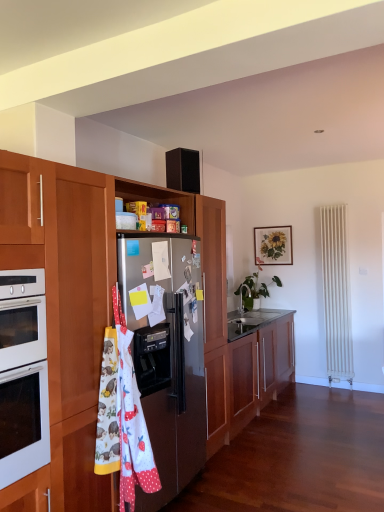
Image resolution: width=384 pixels, height=512 pixels. What are the coordinates of `wooden cabinet at center, the 2th cabinetry viewed from the top` in the screenshot? It's located at (258, 361).

Describe the element at coordinates (128, 327) in the screenshot. I see `wooden cabinet at center, marked as the 2th cabinetry in a bottom-to-top arrangement` at that location.

What do you see at coordinates (168, 359) in the screenshot? The height and width of the screenshot is (512, 384). I see `satin metallic refrigerator at center-left` at bounding box center [168, 359].

Identify the location of wooden cabinet at center, which is the first cabinetry from bottom to top. The height and width of the screenshot is (512, 384). (258, 361).

Would you consider wooden picture frame at upper center to be distant from white fabric apron at center-left?

wooden picture frame at upper center is positioned a significant distance from white fabric apron at center-left.

Does wooden picture frame at upper center contain white fabric apron at center-left?

A: No, white fabric apron at center-left is not surrounded by wooden picture frame at upper center.

Where is `material that is on the left side of wooden picture frame at upper center`? material that is on the left side of wooden picture frame at upper center is located at coordinates (131, 421).

What's the angular difference between wooden picture frame at upper center and white fabric apron at center-left's facing directions?

The angle between the facing direction of wooden picture frame at upper center and the facing direction of white fabric apron at center-left is 88.4 degrees.

From the picture: Which of these two, satin metallic refrigerator at center-left or green glossy plant at center, stands taller?

With more height is satin metallic refrigerator at center-left.

Which object is positioned more to the right, satin metallic refrigerator at center-left or green glossy plant at center?

From the viewer's perspective, green glossy plant at center appears more on the right side.

From the image's perspective, is satin metallic refrigerator at center-left positioned above or below green glossy plant at center?

satin metallic refrigerator at center-left is situated lower than green glossy plant at center in the image.

Considering the sizes of satin metallic refrigerator at center-left and wooden picture frame at upper center in the image, is satin metallic refrigerator at center-left taller or shorter than wooden picture frame at upper center?

In the image, satin metallic refrigerator at center-left appears to be taller than wooden picture frame at upper center.

Could you tell me if satin metallic refrigerator at center-left is turned towards wooden picture frame at upper center?

No.

From the image's perspective, which one is positioned lower, satin metallic refrigerator at center-left or wooden picture frame at upper center?

satin metallic refrigerator at center-left.

Locate an element on the screen. This screenshot has height=512, width=384. picture frame that appears above the satin metallic refrigerator at center-left (from a real-world perspective) is located at coordinates (273, 245).

Looking at their sizes, would you say wooden cabinet at center, marked as the 2th cabinetry in a bottom-to-top arrangement, is wider or thinner than wooden picture frame at upper center?

wooden cabinet at center, marked as the 2th cabinetry in a bottom-to-top arrangement, is wider than wooden picture frame at upper center.

Between wooden cabinet at center, the first cabinetry viewed from the top, and wooden picture frame at upper center, which one appears on the left side from the viewer's perspective?

From the viewer's perspective, wooden cabinet at center, the first cabinetry viewed from the top, appears more on the left side.

Is wooden cabinet at center, the first cabinetry viewed from the top, next to wooden picture frame at upper center?

No.

How distant is wooden cabinet at center, marked as the 2th cabinetry in a bottom-to-top arrangement, from wooden picture frame at upper center?

wooden cabinet at center, marked as the 2th cabinetry in a bottom-to-top arrangement, and wooden picture frame at upper center are 8.90 feet apart.

Which of these two, white fabric apron at center-left or wooden cabinet at center, the first cabinetry viewed from the top, stands taller?

wooden cabinet at center, the first cabinetry viewed from the top, is taller.

From a real-world perspective, is white fabric apron at center-left on wooden cabinet at center, the first cabinetry viewed from the top?

No, from a real-world perspective, white fabric apron at center-left is not above wooden cabinet at center, the first cabinetry viewed from the top.

Looking at their sizes, would you say white fabric apron at center-left is wider or thinner than wooden cabinet at center, marked as the 2th cabinetry in a bottom-to-top arrangement?

In the image, white fabric apron at center-left appears to be more narrow than wooden cabinet at center, marked as the 2th cabinetry in a bottom-to-top arrangement.

Looking at this image, considering the relative positions of white fabric apron at center-left and wooden cabinet at center, marked as the 2th cabinetry in a bottom-to-top arrangement, in the image provided, is white fabric apron at center-left to the right of wooden cabinet at center, marked as the 2th cabinetry in a bottom-to-top arrangement, from the viewer's perspective?

No, white fabric apron at center-left is not to the right of wooden cabinet at center, marked as the 2th cabinetry in a bottom-to-top arrangement.

From a real-world perspective, is wooden picture frame at upper center physically located above or below wooden cabinet at center, the first cabinetry viewed from the top?

wooden picture frame at upper center is above wooden cabinet at center, the first cabinetry viewed from the top.

Is wooden picture frame at upper center oriented away from wooden cabinet at center, the first cabinetry viewed from the top?

No, wooden picture frame at upper center is not facing the opposite direction of wooden cabinet at center, the first cabinetry viewed from the top.

Considering the relative positions of wooden picture frame at upper center and wooden cabinet at center, the first cabinetry viewed from the top, in the image provided, is wooden picture frame at upper center to the left of wooden cabinet at center, the first cabinetry viewed from the top, from the viewer's perspective?

Incorrect, wooden picture frame at upper center is not on the left side of wooden cabinet at center, the first cabinetry viewed from the top.

Would you consider wooden picture frame at upper center to be distant from wooden cabinet at center, the first cabinetry viewed from the top?

Yes, wooden picture frame at upper center and wooden cabinet at center, the first cabinetry viewed from the top, are located far from each other.

Can satin metallic refrigerator at center-left be found inside white fabric apron at center-left?

No, white fabric apron at center-left does not contain satin metallic refrigerator at center-left.

From the image's perspective, between white fabric apron at center-left and satin metallic refrigerator at center-left, who is located below?

white fabric apron at center-left is shown below in the image.

Is white fabric apron at center-left bigger than satin metallic refrigerator at center-left?

No.

Identify the location of picture frame located above the white fabric apron at center-left (from a real-world perspective). (273, 245).

Identify the location of refrigerator on the left of green glossy plant at center. This screenshot has height=512, width=384. (168, 359).

Looking at the image, which one is located further to satin metallic refrigerator at center-left, wooden picture frame at upper center or green glossy plant at center?

The object further to satin metallic refrigerator at center-left is wooden picture frame at upper center.

Which object lies further to the anchor point wooden cabinet at center, which is the first cabinetry from bottom to top, wooden picture frame at upper center or green glossy plant at center?

Based on the image, wooden picture frame at upper center appears to be further to wooden cabinet at center, which is the first cabinetry from bottom to top.

From the image, which object appears to be nearer to wooden cabinet at center, marked as the 2th cabinetry in a bottom-to-top arrangement, green glossy plant at center or wooden cabinet at center, which is the first cabinetry from bottom to top?

wooden cabinet at center, which is the first cabinetry from bottom to top.

From the image, which object appears to be nearer to wooden picture frame at upper center, green glossy plant at center or wooden cabinet at center, the first cabinetry viewed from the top?

Among the two, green glossy plant at center is located nearer to wooden picture frame at upper center.

Consider the image. From the image, which object appears to be farther from green glossy plant at center, white fabric apron at center-left or wooden cabinet at center, the 2th cabinetry viewed from the top?

A: white fabric apron at center-left is positioned further to the anchor green glossy plant at center.

When comparing their distances from wooden cabinet at center, the 2th cabinetry viewed from the top, does satin metallic refrigerator at center-left or green glossy plant at center seem further?

Among the two, satin metallic refrigerator at center-left is located further to wooden cabinet at center, the 2th cabinetry viewed from the top.

Which object lies nearer to the anchor point wooden picture frame at upper center, satin metallic refrigerator at center-left or green glossy plant at center?

green glossy plant at center lies closer to wooden picture frame at upper center than the other object.

When comparing their distances from green glossy plant at center, does wooden cabinet at center, which is the first cabinetry from bottom to top, or wooden picture frame at upper center seem further?

wooden picture frame at upper center.

This screenshot has height=512, width=384. Identify the location of houseplant between satin metallic refrigerator at center-left and wooden picture frame at upper center from front to back. (252, 290).

Where is `material between wooden cabinet at center, marked as the 2th cabinetry in a bottom-to-top arrangement, and satin metallic refrigerator at center-left from front to back`? material between wooden cabinet at center, marked as the 2th cabinetry in a bottom-to-top arrangement, and satin metallic refrigerator at center-left from front to back is located at coordinates (131, 421).

At what (x,y) coordinates should I click in order to perform the action: click on cabinetry positioned between wooden cabinet at center, the first cabinetry viewed from the top, and green glossy plant at center from near to far. Please return your answer as a coordinate pair (x, y). This screenshot has width=384, height=512. Looking at the image, I should click on (258, 361).

Image resolution: width=384 pixels, height=512 pixels. What are the coordinates of `houseplant between white fabric apron at center-left and wooden picture frame at upper center from front to back` in the screenshot? It's located at (252, 290).